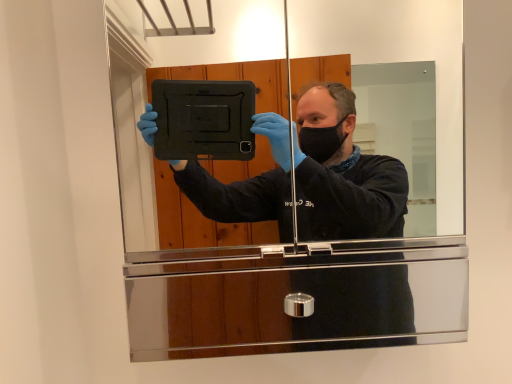
Question: Should I look upward or downward to see polished silver mirror at center?

Choices:
 (A) down
 (B) up

Answer: (B)